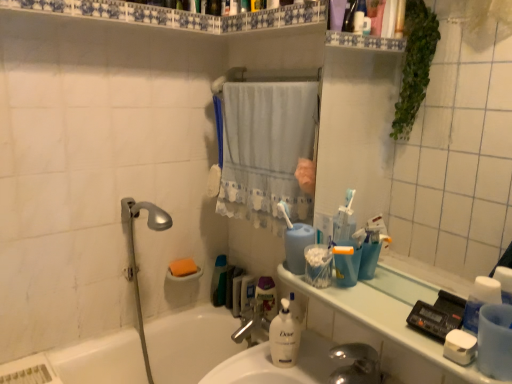
Question: Considering the relative sizes of orange sponge at lower left, the 1th soap viewed from the left, and white plastic toothbrush at center in the image provided, is orange sponge at lower left, the 1th soap viewed from the left, taller than white plastic toothbrush at center?

Choices:
 (A) no
 (B) yes

Answer: (A)

Question: Considering the relative sizes of orange sponge at lower left, marked as the first soap in a back-to-front arrangement, and white plastic toothbrush at center in the image provided, is orange sponge at lower left, marked as the first soap in a back-to-front arrangement, thinner than white plastic toothbrush at center?

Choices:
 (A) no
 (B) yes

Answer: (A)

Question: Is orange sponge at lower left, the 2th soap when ordered from front to back, touching white plastic toothbrush at center?

Choices:
 (A) no
 (B) yes

Answer: (A)

Question: Is orange sponge at lower left, the 2th soap when ordered from front to back, closer to the viewer compared to white plastic toothbrush at center?

Choices:
 (A) no
 (B) yes

Answer: (A)

Question: Considering the relative sizes of orange sponge at lower left, which appears as the 2th soap when viewed from the right, and white plastic toothbrush at center in the image provided, is orange sponge at lower left, which appears as the 2th soap when viewed from the right, smaller than white plastic toothbrush at center?

Choices:
 (A) yes
 (B) no

Answer: (B)

Question: Is white plastic toothbrush at center inside the boundaries of orange sponge at lower left, marked as the first soap in a back-to-front arrangement, or outside?

Choices:
 (A) outside
 (B) inside

Answer: (A)

Question: Would you say white plastic toothbrush at center is to the left or to the right of orange sponge at lower left, the 2th soap when ordered from front to back, in the picture?

Choices:
 (A) left
 (B) right

Answer: (B)

Question: From a real-world perspective, is white plastic toothbrush at center physically located above or below orange sponge at lower left, the 1th soap viewed from the left?

Choices:
 (A) below
 (B) above

Answer: (B)

Question: Is point (281, 205) positioned closer to the camera than point (181, 264)?

Choices:
 (A) farther
 (B) closer

Answer: (B)

Question: In the image, is green plastic bottle at center on the left side or the right side of white glossy bathtub at lower left?

Choices:
 (A) right
 (B) left

Answer: (A)

Question: Considering the positions of green plastic bottle at center and white glossy bathtub at lower left in the image, is green plastic bottle at center taller or shorter than white glossy bathtub at lower left?

Choices:
 (A) tall
 (B) short

Answer: (B)

Question: From the image's perspective, relative to white glossy bathtub at lower left, is green plastic bottle at center above or below?

Choices:
 (A) above
 (B) below

Answer: (A)

Question: Relative to white glossy bathtub at lower left, is green plastic bottle at center in front or behind?

Choices:
 (A) front
 (B) behind

Answer: (B)

Question: From the image's perspective, is white matte soap at lower right, the 2th soap from the left, positioned above or below green plastic bottle at center?

Choices:
 (A) below
 (B) above

Answer: (B)

Question: Is white matte soap at lower right, the 1th soap positioned from the front, wider or thinner than green plastic bottle at center?

Choices:
 (A) thin
 (B) wide

Answer: (B)